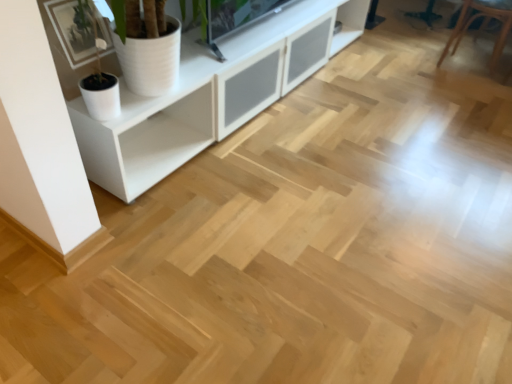
Locate an element on the screen. The width and height of the screenshot is (512, 384). vacant space behind brown leather armchair at upper right is located at coordinates (435, 37).